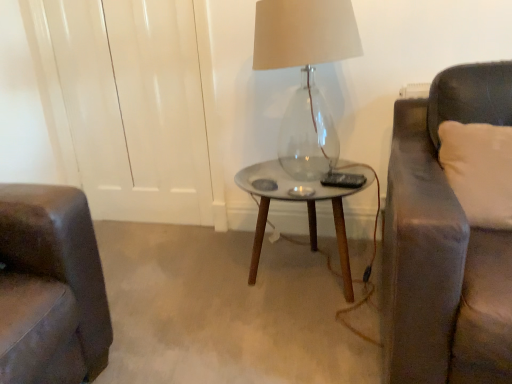
Question: Is translucent glass lamp at center at the right side of white soft cushion at right?

Choices:
 (A) yes
 (B) no

Answer: (B)

Question: Can you confirm if translucent glass lamp at center is wider than white soft cushion at right?

Choices:
 (A) no
 (B) yes

Answer: (B)

Question: Is translucent glass lamp at center thinner than white soft cushion at right?

Choices:
 (A) no
 (B) yes

Answer: (A)

Question: Is the depth of translucent glass lamp at center less than that of white soft cushion at right?

Choices:
 (A) no
 (B) yes

Answer: (A)

Question: From the image's perspective, is translucent glass lamp at center on white soft cushion at right?

Choices:
 (A) no
 (B) yes

Answer: (B)

Question: Is the position of translucent glass lamp at center more distant than that of white soft cushion at right?

Choices:
 (A) yes
 (B) no

Answer: (A)

Question: From the image's perspective, is metallic silver table at center beneath translucent glass lamp at center?

Choices:
 (A) no
 (B) yes

Answer: (B)

Question: Can you confirm if metallic silver table at center is wider than translucent glass lamp at center?

Choices:
 (A) yes
 (B) no

Answer: (A)

Question: From a real-world perspective, is metallic silver table at center physically below translucent glass lamp at center?

Choices:
 (A) no
 (B) yes

Answer: (B)

Question: Can you confirm if metallic silver table at center is shorter than translucent glass lamp at center?

Choices:
 (A) yes
 (B) no

Answer: (A)

Question: Considering the relative sizes of metallic silver table at center and translucent glass lamp at center in the image provided, is metallic silver table at center smaller than translucent glass lamp at center?

Choices:
 (A) no
 (B) yes

Answer: (A)

Question: Is metallic silver table at center bigger than translucent glass lamp at center?

Choices:
 (A) no
 (B) yes

Answer: (B)

Question: Does white soft cushion at right lie in front of translucent glass lamp at center?

Choices:
 (A) yes
 (B) no

Answer: (A)